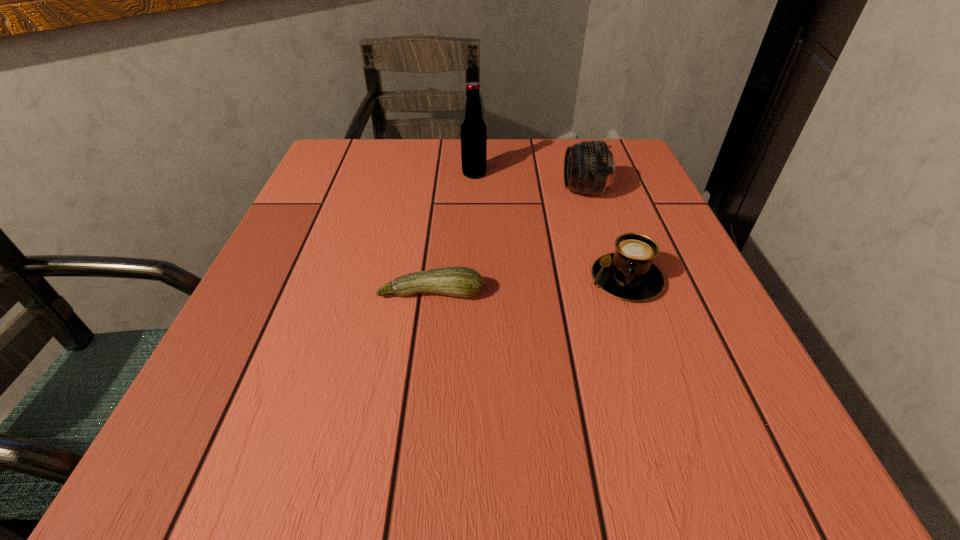
The height and width of the screenshot is (540, 960). What are the coordinates of `the tallest object` in the screenshot? It's located at (473, 129).

You are a GUI agent. You are given a task and a screenshot of the screen. Output one action in this format:
    pyautogui.click(x=<x>, y=<y>)
    Task: Click on the second tallest object
    This screenshot has width=960, height=540.
    Given the screenshot: What is the action you would take?
    pyautogui.click(x=589, y=168)

Where is `cappuccino`? This screenshot has width=960, height=540. cappuccino is located at coordinates (629, 273).

Image resolution: width=960 pixels, height=540 pixels. I want to click on the shortest object, so click(x=464, y=282).

I want to click on free spot located 0.180m on the front of the beer bottle, so click(x=473, y=228).

The width and height of the screenshot is (960, 540). In order to click on vacant space located 0.250m at the front element of the telephoto lens in this screenshot , I will do `click(450, 191)`.

What are the coordinates of `free spot located 0.250m at the front element of the telephoto lens` in the screenshot? It's located at (450, 191).

I want to click on free point located 0.150m at the front element of the telephoto lens, so click(496, 191).

This screenshot has width=960, height=540. I want to click on free location located on the back of the cappuccino, so click(584, 158).

Locate an element on the screen. The width and height of the screenshot is (960, 540). free space located at the stem end of the zucchini is located at coordinates (411, 470).